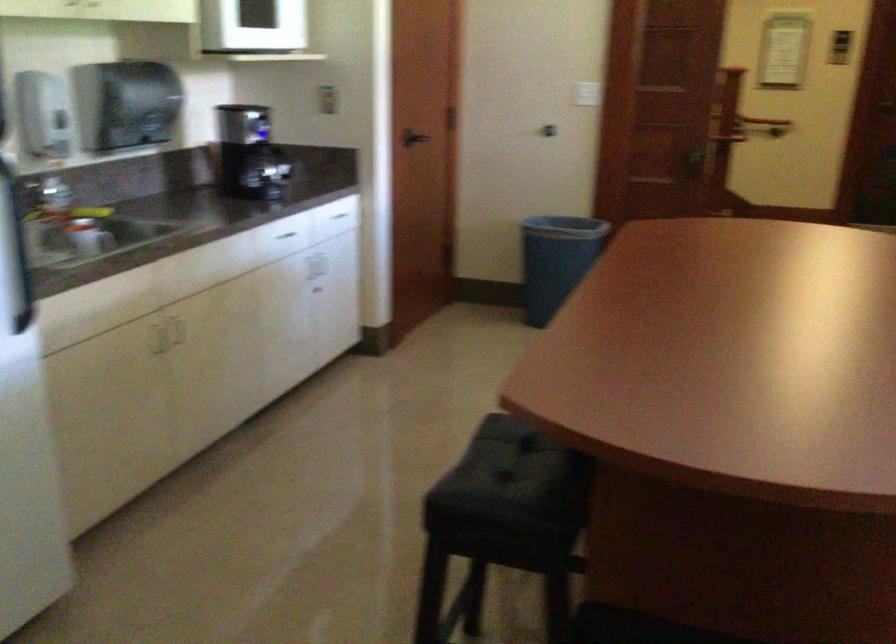
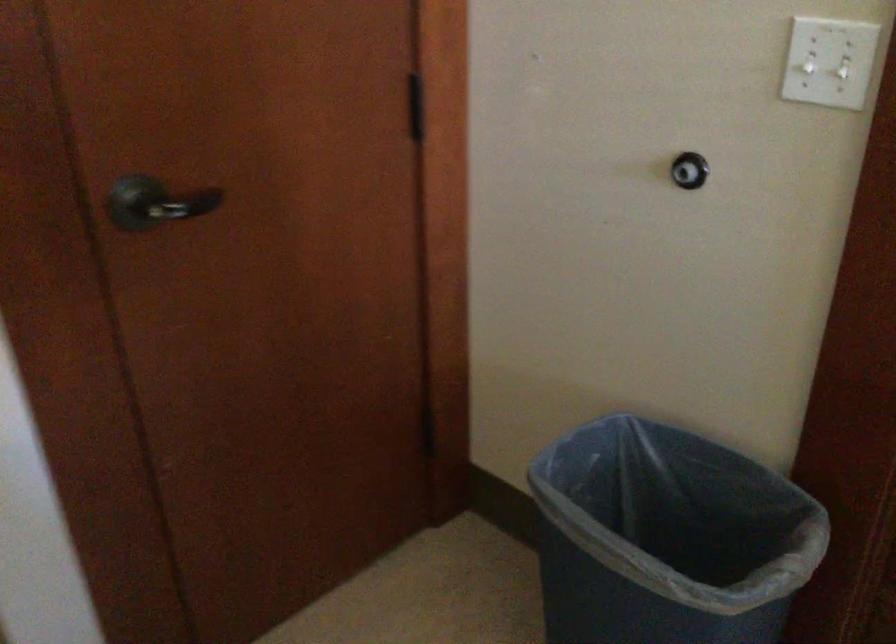
Question: In a continuous first-person perspective shot, in which direction is the camera moving?

Choices:
 (A) Left
 (B) Right
 (C) Forward
 (D) Backward

Answer: (C)